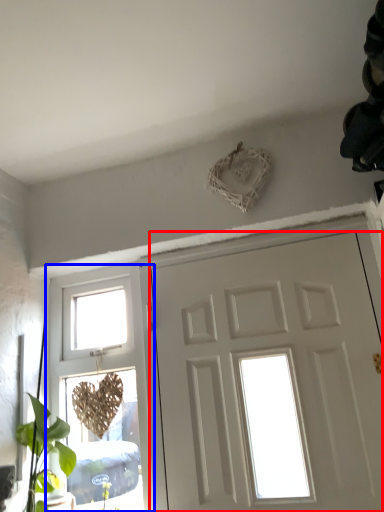
Question: Among these objects, which one is farthest to the camera, door (highlighted by a red box) or window (highlighted by a blue box)?

Choices:
 (A) door
 (B) window

Answer: (B)